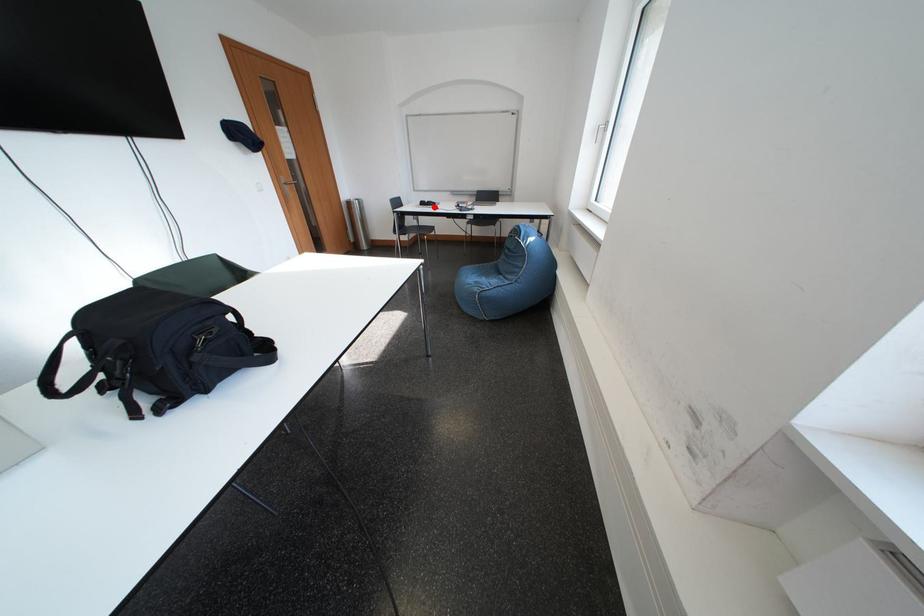
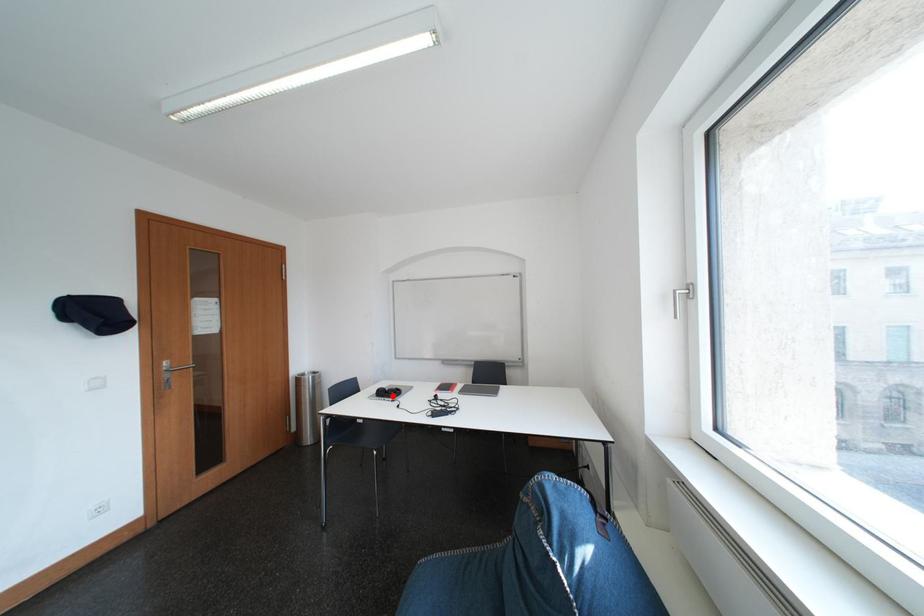
Looking at this image, I am providing you with two images of the same scene from different viewpoints. A red point is marked on the first image and another point is marked on the second image. Are the points marked in image1 and image2 representing the same 3D position?

Yes